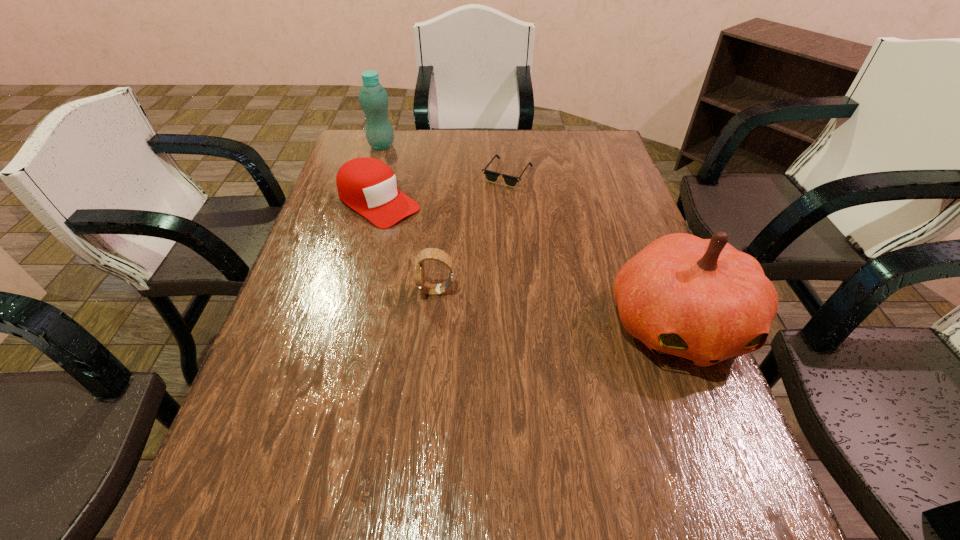
You are a GUI agent. You are given a task and a screenshot of the screen. Output one action in this format:
    pyautogui.click(x=<x>, y=<y>)
    Task: Click on the watch
    
    Given the screenshot: What is the action you would take?
    click(435, 254)

You are a GUI agent. You are given a task and a screenshot of the screen. Output one action in this format:
    pyautogui.click(x=<x>, y=<y>)
    Task: Click on the pumpkin
    
    Given the screenshot: What is the action you would take?
    pyautogui.click(x=700, y=300)

Where is `sunglasses`? The height and width of the screenshot is (540, 960). sunglasses is located at coordinates (491, 176).

At what (x,y) coordinates should I click in order to perform the action: click on the shortest object. Please return your answer as a coordinate pair (x, y). The image size is (960, 540). Looking at the image, I should click on (491, 176).

Identify the location of the farthest object. This screenshot has height=540, width=960. (373, 98).

This screenshot has width=960, height=540. Find the location of `baseball cap`. baseball cap is located at coordinates (367, 185).

The height and width of the screenshot is (540, 960). I want to click on vacant point located on the face of the watch, so click(x=369, y=291).

Identify the location of vacant space situated on the face of the watch. (331, 291).

Identify the location of vacant point located 0.280m on the face of the watch. This screenshot has height=540, width=960. (301, 291).

Where is `vacant point located on the front-facing side of the rightmost object`? vacant point located on the front-facing side of the rightmost object is located at coordinates (720, 433).